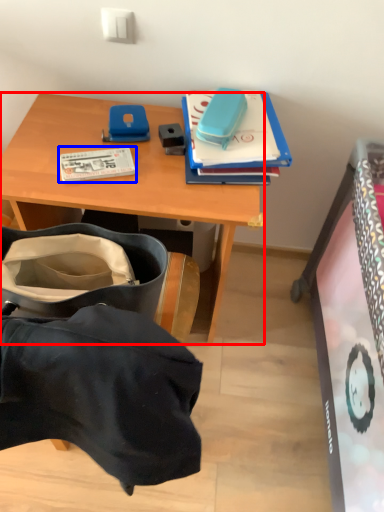
Question: Among these objects, which one is farthest to the camera, desk (highlighted by a red box) or book (highlighted by a blue box)?

Choices:
 (A) desk
 (B) book

Answer: (B)